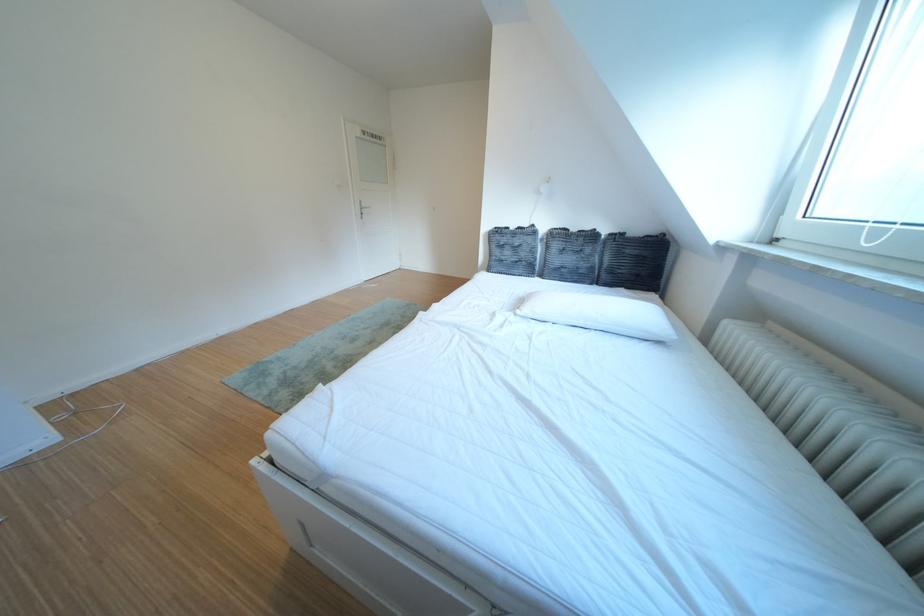
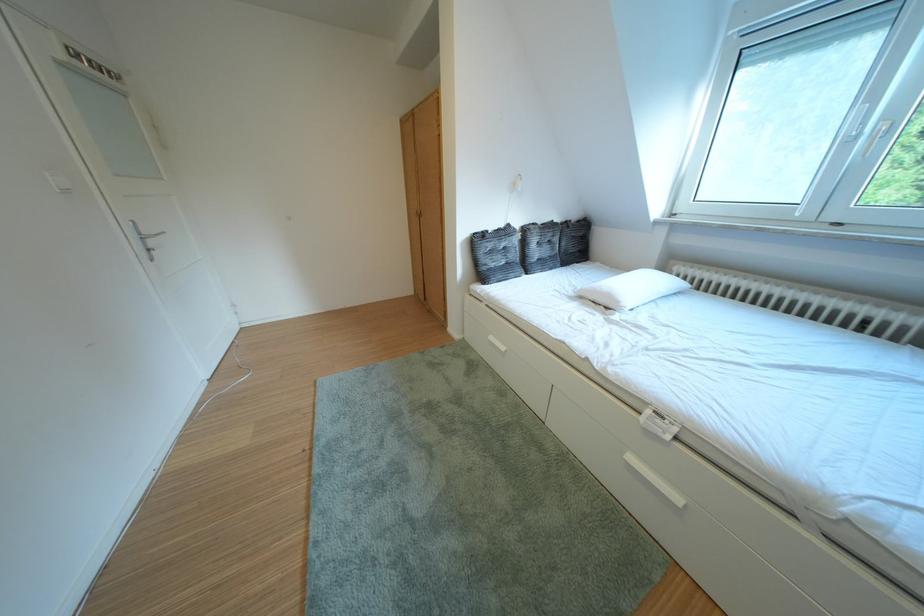
Locate, in the second image, the point that corresponds to [521,233] in the first image.

(500, 237)